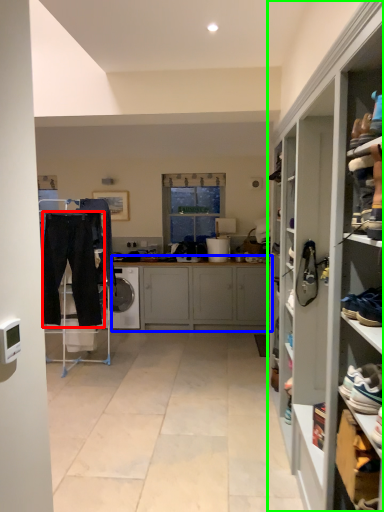
Question: Which object is the farthest from trousers (highlighted by a red box)? Choose among these: cabinetry (highlighted by a blue box) or cupboard (highlighted by a green box).

Choices:
 (A) cabinetry
 (B) cupboard

Answer: (B)